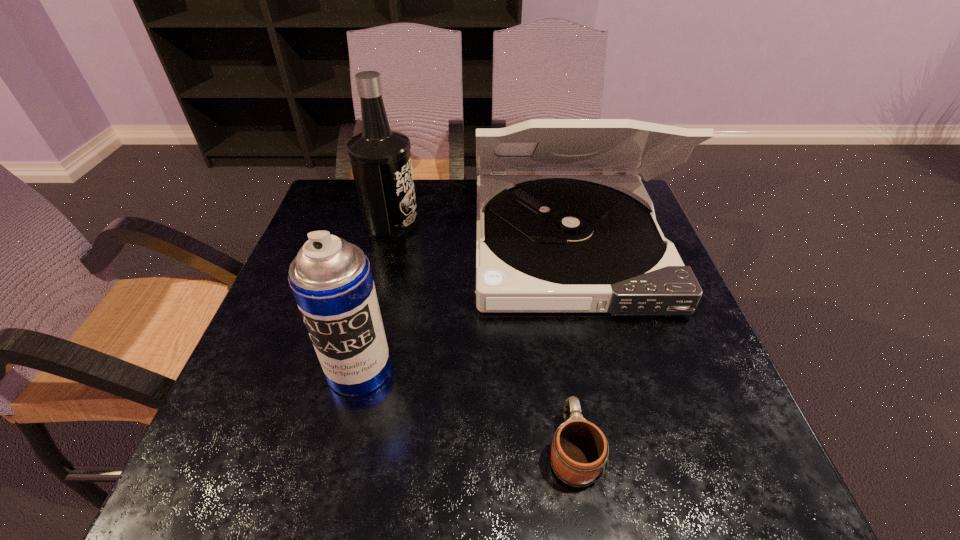
You are a GUI agent. You are given a task and a screenshot of the screen. Output one action in this format:
    pyautogui.click(x=<x>, y=<y>)
    Task: Click on the liquor
    The width and height of the screenshot is (960, 540).
    Given the screenshot: What is the action you would take?
    pyautogui.click(x=380, y=158)

This screenshot has height=540, width=960. What are the coordinates of `CD player` in the screenshot? It's located at (545, 243).

Locate an element on the screen. This screenshot has height=540, width=960. the third farthest object is located at coordinates (331, 279).

Find the location of a particular element. The width and height of the screenshot is (960, 540). the shortest object is located at coordinates (579, 451).

Where is `the nearest object`? the nearest object is located at coordinates (579, 451).

Where is `free location located on the front label of the liquor`? The width and height of the screenshot is (960, 540). free location located on the front label of the liquor is located at coordinates (445, 221).

You are a GUI agent. You are given a task and a screenshot of the screen. Output one action in this format:
    pyautogui.click(x=<x>, y=<y>)
    Task: Click on the free location located on the control panel of the CD player
    Image resolution: width=960 pixels, height=540 pixels.
    Given the screenshot: What is the action you would take?
    pyautogui.click(x=616, y=457)

Image resolution: width=960 pixels, height=540 pixels. Find the location of `free space located 0.090m on the label side of the aerosol can`. free space located 0.090m on the label side of the aerosol can is located at coordinates (342, 447).

Find the location of a particular element. Image resolution: width=960 pixels, height=540 pixels. vacant area situated on the side of the mug with the handle is located at coordinates (549, 305).

This screenshot has height=540, width=960. In order to click on blank space located 0.310m on the side of the mug with the handle in this screenshot , I will do `click(547, 288)`.